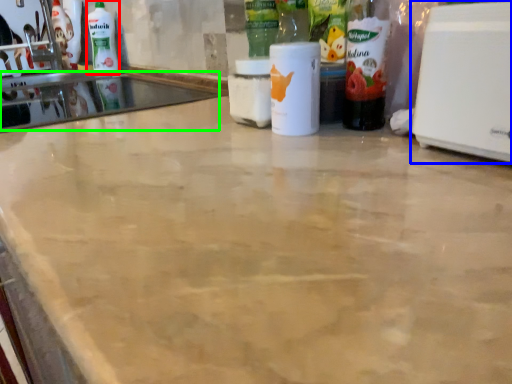
Question: Considering the real-world distances, which object is closest to cleaning product (highlighted by a red box)? home appliance (highlighted by a blue box) or sink (highlighted by a green box).

Choices:
 (A) home appliance
 (B) sink

Answer: (B)